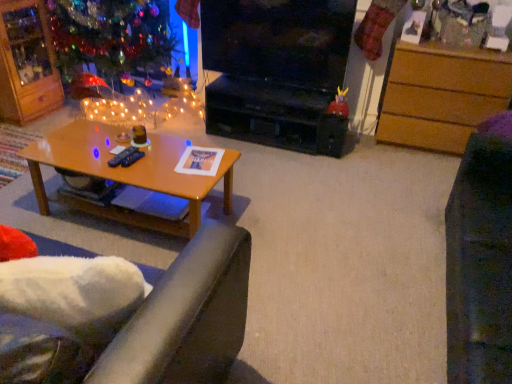
I want to click on vacant area located to the right-hand side of wooden coffee table at center, so click(x=284, y=228).